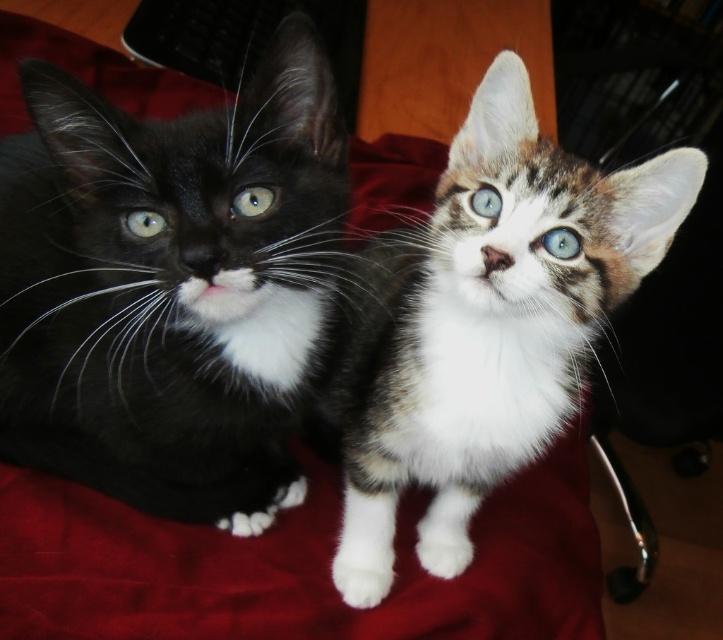
You are a photographer trying to capture a closeup of the kittens. You notice two points in the image labeled as point (496, 333) and point (560, 241). Which point is closer to you, the photographer?

Point (496, 333) is further to the viewer than point (560, 241). Therefore, point (560, 241) is closer to you.

You are taking a photo of two kittens on a red fabric surface. You notice two points marked in the image. The first point is at coordinates point (372, 428) and the second point is at coordinates point (254, 188). Which point is closer to the camera?

Point (372, 428) is further to the camera than point (254, 188), so the second point is closer to the camera.